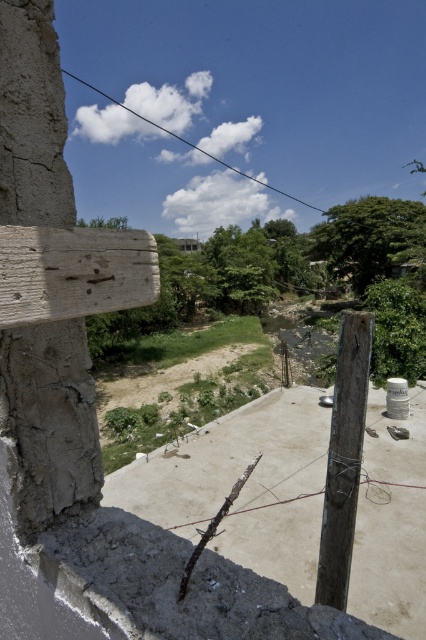
Question: Does weathered wood plank at left appear on the left side of weathered wood post at center-right?

Choices:
 (A) no
 (B) yes

Answer: (B)

Question: Which point is farther from the camera taking this photo?

Choices:
 (A) (354, 522)
 (B) (97, 305)

Answer: (A)

Question: Is weathered wood plank at left below weathered wood post at center-right?

Choices:
 (A) yes
 (B) no

Answer: (B)

Question: Considering the relative positions of weathered wood plank at left and weathered wood post at center-right in the image provided, where is weathered wood plank at left located with respect to weathered wood post at center-right?

Choices:
 (A) left
 (B) right

Answer: (A)

Question: Which object appears closest to the camera in this image?

Choices:
 (A) weathered wood plank at left
 (B) weathered wood post at center-right

Answer: (A)

Question: Which of the following is the closest to the observer?

Choices:
 (A) (25, 275)
 (B) (336, 493)

Answer: (A)